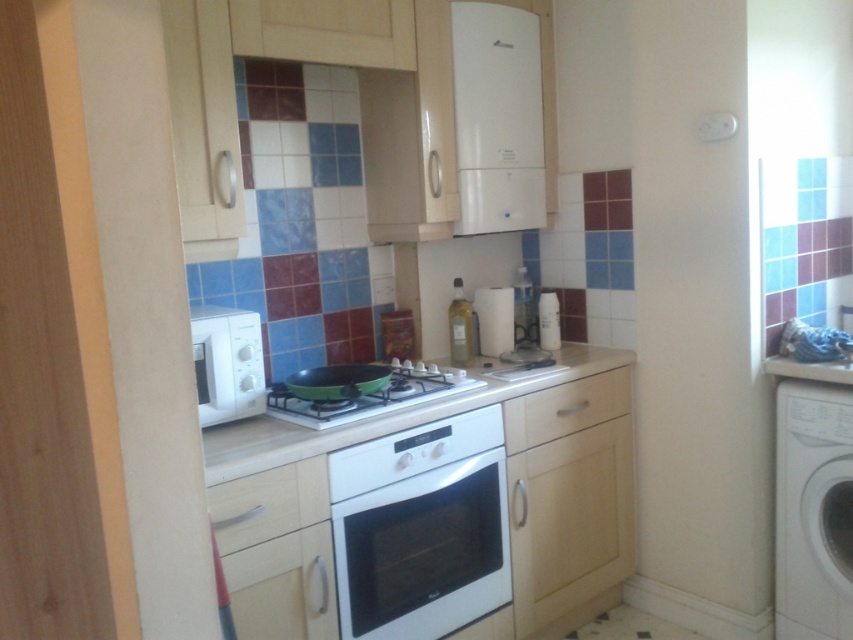
You are a kitchen designer planning to install a new appliance. You have a small microwave that needs to be placed either under the white glossy exhaust hood at upper center or on the white glossy countertop at center. Based on their sizes, which location would provide more space for additional items?

The white glossy countertop at center occupies more space than the white glossy exhaust hood at upper center, so placing the microwave under the white glossy exhaust hood at upper center would leave more space on the white glossy countertop at center for additional items.

You are a chef preparing a dish and need to move a pot from the white glossy countertop at center to the white glossy exhaust hood at upper center. Can you place the pot directly on the exhaust hood?

The white glossy exhaust hood at upper center is to the right of the white glossy countertop at center. However, the exhaust hood is an appliance typically used for ventilation and not designed to hold pots. Therefore, you cannot place the pot directly on the exhaust hood.

You are moving into a new apartment and need to decide where to place your new white plastic washing machine at right and white matte microwave at left. Given their sizes, which appliance should be placed in a taller space?

The white plastic washing machine at right is much taller than the white matte microwave at left, so it should be placed in the taller space.